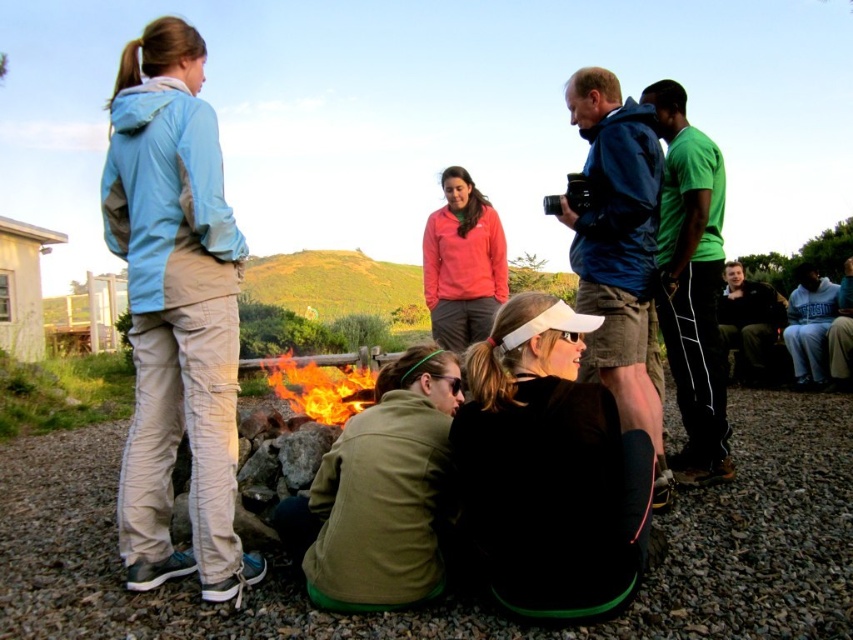
Question: Which object is closer to the camera taking this photo?

Choices:
 (A) black matte visor at center
 (B) flaming wood at center
 (C) matte pink hoodie at center

Answer: (A)

Question: Which of the following is the closest to the observer?

Choices:
 (A) black matte visor at center
 (B) light blue fabric jacket at upper left
 (C) flaming wood at center

Answer: (A)

Question: Can you confirm if black matte visor at center is wider than flaming wood at center?

Choices:
 (A) yes
 (B) no

Answer: (A)

Question: Does light blue fabric jacket at upper left have a lesser width compared to flaming wood at center?

Choices:
 (A) no
 (B) yes

Answer: (A)

Question: Can you confirm if light blue fabric jacket at upper left is positioned to the left of flaming wood at center?

Choices:
 (A) yes
 (B) no

Answer: (A)

Question: Which point is farther to the camera?

Choices:
 (A) flaming wood at center
 (B) matte pink hoodie at center
 (C) black matte visor at center
 (D) light blue fabric jacket at upper left

Answer: (A)